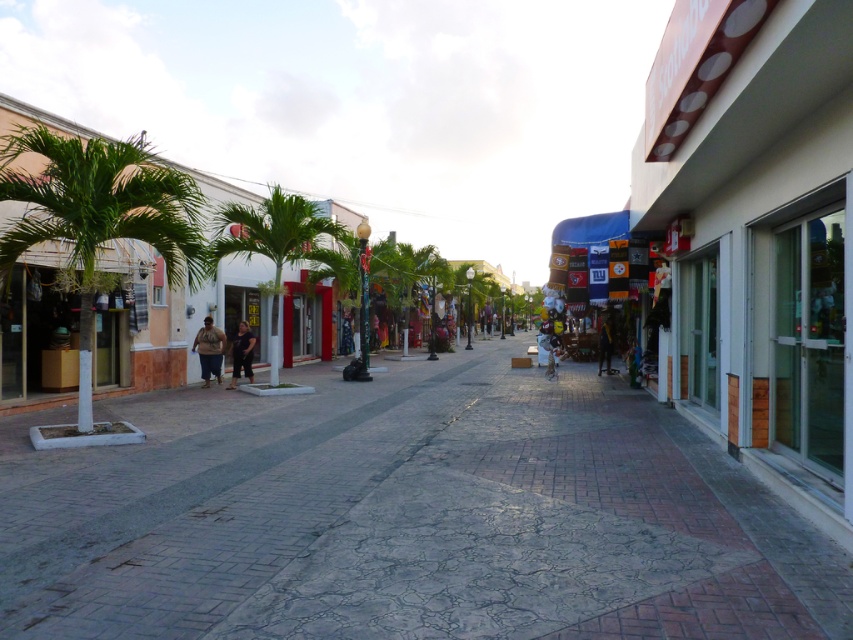
Question: Which point is farther from the camera taking this photo?

Choices:
 (A) (218, 378)
 (B) (605, 342)
 (C) (96, 161)
 (D) (236, 356)

Answer: (B)

Question: From the image, what is the correct spatial relationship of brown fuzzy jacket at center in relation to dark blue jeans at center?

Choices:
 (A) right
 (B) left

Answer: (B)

Question: Which of the following is the farthest from the observer?

Choices:
 (A) (270, 296)
 (B) (22, 198)
 (C) (381, 634)

Answer: (A)

Question: Does gray concrete pavement at center have a lesser width compared to green leafy palm tree at center?

Choices:
 (A) yes
 (B) no

Answer: (B)

Question: Can you confirm if green leafy palm tree at center is smaller than dark blue jeans at center?

Choices:
 (A) yes
 (B) no

Answer: (B)

Question: Among these points, which one is farthest from the camera?

Choices:
 (A) (254, 230)
 (B) (218, 356)
 (C) (611, 339)
 (D) (241, 362)

Answer: (C)